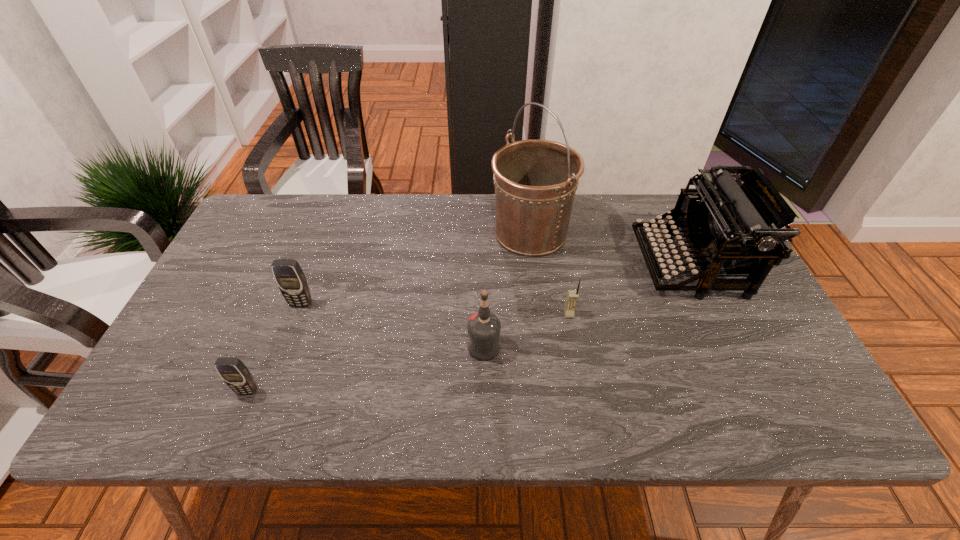
Where is `free space located on the typing side of the typewriter`? This screenshot has height=540, width=960. free space located on the typing side of the typewriter is located at coordinates (545, 264).

I want to click on vacant space situated 0.150m on the typing side of the typewriter, so click(588, 264).

Locate an element on the screen. The image size is (960, 540). vacant area situated on the typing side of the typewriter is located at coordinates (539, 264).

Image resolution: width=960 pixels, height=540 pixels. What are the coordinates of `vacant space located 0.110m on the front label of the fourth shortest object` in the screenshot? It's located at (421, 348).

I want to click on blank space located on the front label of the fourth shortest object, so click(388, 348).

I want to click on vacant space located 0.380m on the front label of the fourth shortest object, so click(308, 348).

Locate an element on the screen. vacant space situated 0.170m on the front face of the farthest cellular telephone is located at coordinates (279, 365).

You are a GUI agent. You are given a task and a screenshot of the screen. Output one action in this format:
    pyautogui.click(x=<x>, y=<y>)
    Task: Click on the free space located on the front of the fourth farthest object, where the keypad is located
    The width and height of the screenshot is (960, 540).
    Given the screenshot: What is the action you would take?
    pyautogui.click(x=579, y=370)

Find the location of a particular element. vacant space located 0.080m on the front face of the nearest object is located at coordinates (231, 431).

Where is `bucket present at the far edge`? The width and height of the screenshot is (960, 540). bucket present at the far edge is located at coordinates (535, 181).